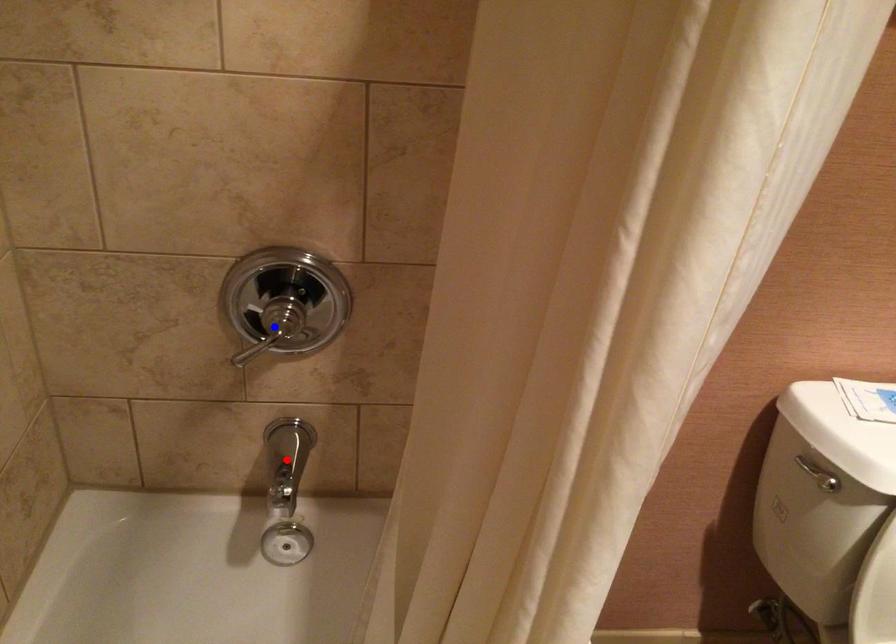
Question: Two points are marked on the image. Which point is closer to the camera?

Choices:
 (A) Blue point is closer.
 (B) Red point is closer.

Answer: (A)